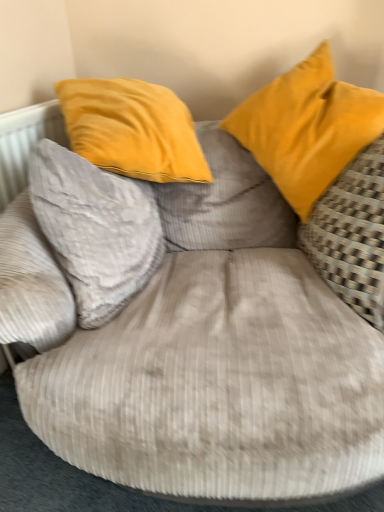
Question: Does gray corduroy pillow at left, which is the 3th pillow in right-to-left order, have a smaller size compared to yellow fabric pillow at right, which is the 3th pillow in left-to-right order?

Choices:
 (A) yes
 (B) no

Answer: (A)

Question: Could yellow fabric pillow at right, the 1th pillow viewed from the right, be considered to be inside gray corduroy pillow at left, which is the 3th pillow in right-to-left order?

Choices:
 (A) no
 (B) yes

Answer: (A)

Question: Can you confirm if gray corduroy pillow at left, which is the 3th pillow in right-to-left order, is positioned to the right of yellow fabric pillow at right, which is the 3th pillow in left-to-right order?

Choices:
 (A) no
 (B) yes

Answer: (A)

Question: Is gray corduroy pillow at left, the 1th pillow in the left-to-right sequence, at the left side of yellow fabric pillow at right, which is the 3th pillow in left-to-right order?

Choices:
 (A) no
 (B) yes

Answer: (B)

Question: From a real-world perspective, is gray corduroy pillow at left, the 1th pillow in the left-to-right sequence, beneath yellow fabric pillow at right, the 1th pillow viewed from the right?

Choices:
 (A) yes
 (B) no

Answer: (B)

Question: Relative to matte yellow pillow at upper right, acting as the 2th pillow starting from the left, is gray corduroy pillow at left, which is the 3th pillow in right-to-left order, in front or behind?

Choices:
 (A) front
 (B) behind

Answer: (A)

Question: From the image's perspective, is gray corduroy pillow at left, which is the 3th pillow in right-to-left order, above or below matte yellow pillow at upper right, acting as the 2th pillow starting from the left?

Choices:
 (A) above
 (B) below

Answer: (B)

Question: Is point (51, 201) closer or farther from the camera than point (329, 157)?

Choices:
 (A) closer
 (B) farther

Answer: (A)

Question: Is gray corduroy pillow at left, which is the 3th pillow in right-to-left order, wider or thinner than matte yellow pillow at upper right, acting as the 2th pillow starting from the left?

Choices:
 (A) thin
 (B) wide

Answer: (A)

Question: In terms of height, does matte yellow pillow at upper right, acting as the 2th pillow starting from the left, look taller or shorter compared to yellow fabric pillow at right, the 1th pillow viewed from the right?

Choices:
 (A) short
 (B) tall

Answer: (A)

Question: Is matte yellow pillow at upper right, which appears as the 2th pillow when viewed from the right, to the left or to the right of yellow fabric pillow at right, which is the 3th pillow in left-to-right order, in the image?

Choices:
 (A) right
 (B) left

Answer: (B)

Question: From the image's perspective, is matte yellow pillow at upper right, which appears as the 2th pillow when viewed from the right, above or below yellow fabric pillow at right, the 1th pillow viewed from the right?

Choices:
 (A) above
 (B) below

Answer: (A)

Question: From a real-world perspective, is matte yellow pillow at upper right, acting as the 2th pillow starting from the left, above or below yellow fabric pillow at right, the 1th pillow viewed from the right?

Choices:
 (A) above
 (B) below

Answer: (A)

Question: Relative to matte yellow pillow at upper right, which appears as the 2th pillow when viewed from the right, is yellow fabric pillow at right, the 1th pillow viewed from the right, in front or behind?

Choices:
 (A) behind
 (B) front

Answer: (B)

Question: From a real-world perspective, is yellow fabric pillow at right, the 1th pillow viewed from the right, positioned above or below matte yellow pillow at upper right, acting as the 2th pillow starting from the left?

Choices:
 (A) above
 (B) below

Answer: (B)